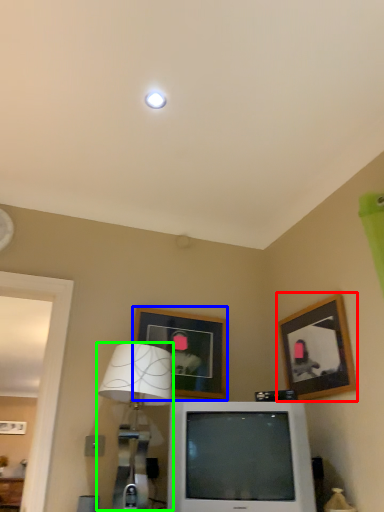
Question: Which object is the closest to the picture frame (highlighted by a red box)? Choose among these: picture frame (highlighted by a blue box) or table lamp (highlighted by a green box).

Choices:
 (A) picture frame
 (B) table lamp

Answer: (A)